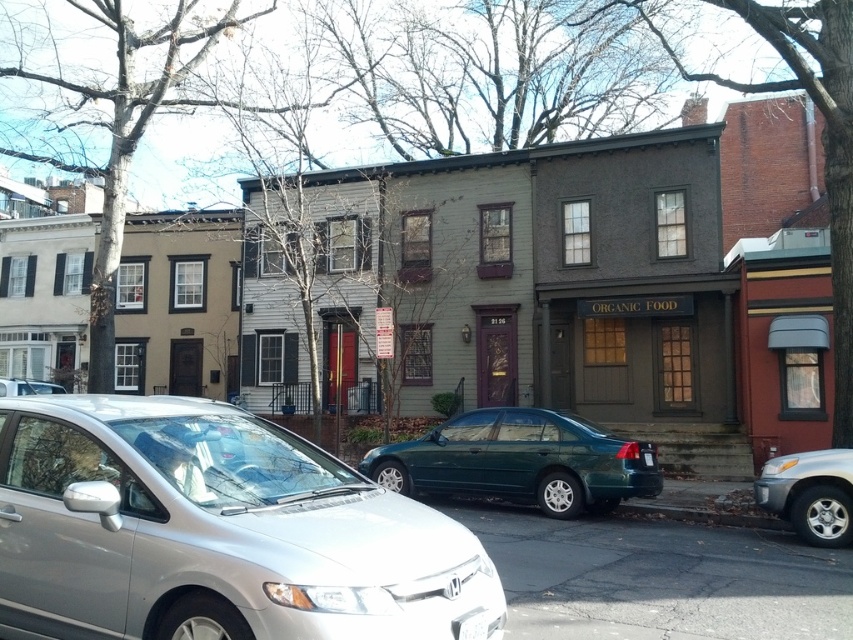
Between satin silver sedan at center and teal glossy sedan at center, which one is positioned higher?

satin silver sedan at center is above.

Between satin silver sedan at center and teal glossy sedan at center, which one has more height?

teal glossy sedan at center is taller.

At what (x,y) coordinates should I click in order to perform the action: click on satin silver sedan at center. Please return your answer as a coordinate pair (x, y). The width and height of the screenshot is (853, 640). Looking at the image, I should click on (216, 531).

Does satin silver sedan at center appear under silver metallic suv at lower right?

Incorrect, satin silver sedan at center is not positioned below silver metallic suv at lower right.

Is satin silver sedan at center taller than silver metallic suv at lower right?

Correct, satin silver sedan at center is much taller as silver metallic suv at lower right.

Who is more forward, (397, 557) or (802, 492)?

Point (397, 557) is in front.

Where is `satin silver sedan at center`? Image resolution: width=853 pixels, height=640 pixels. satin silver sedan at center is located at coordinates (216, 531).

Where is `silver metallic suv at lower right`? The height and width of the screenshot is (640, 853). silver metallic suv at lower right is located at coordinates (810, 493).

Between point (834, 492) and point (643, 451), which one is positioned behind?

The point (643, 451) is behind.

I want to click on silver metallic suv at lower right, so click(x=810, y=493).

Locate an element on the screen. This screenshot has width=853, height=640. silver metallic suv at lower right is located at coordinates (810, 493).